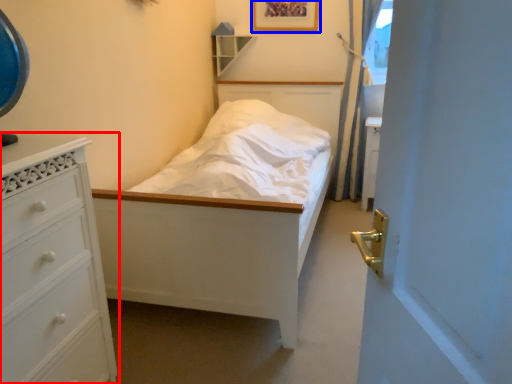
Question: Which point is closer to the camera, chest of drawers (highlighted by a red box) or picture frame (highlighted by a blue box)?

Choices:
 (A) chest of drawers
 (B) picture frame

Answer: (A)